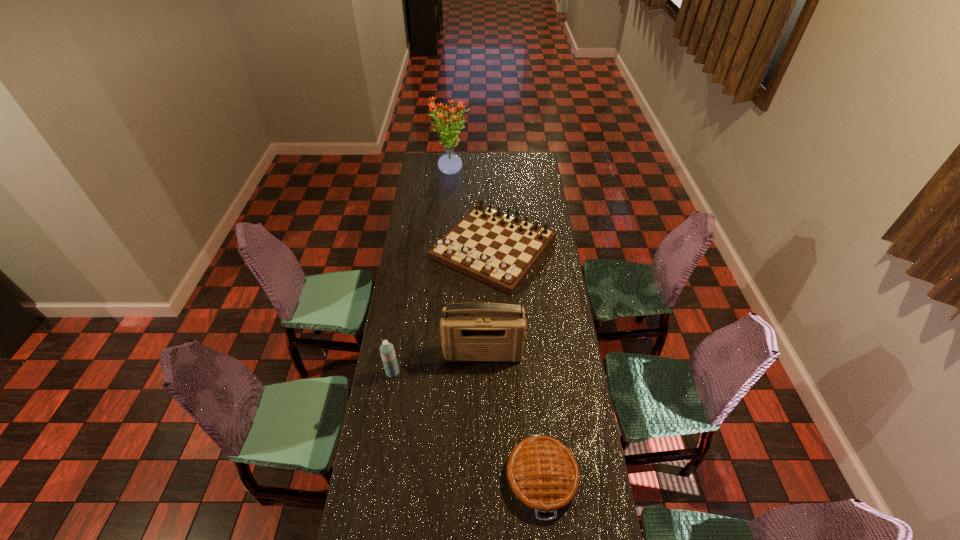
What are the coordinates of `object that is at the far left corner` in the screenshot? It's located at tap(449, 163).

Identify the location of vacant space at the far edge of the desktop. (482, 159).

Image resolution: width=960 pixels, height=540 pixels. In the image, there is a desktop. Find the location of `vacant space at the left edge`. vacant space at the left edge is located at coordinates (372, 503).

Where is `vacant space at the right edge of the desktop`? This screenshot has width=960, height=540. vacant space at the right edge of the desktop is located at coordinates (573, 524).

In the image, there is a desktop. Identify the location of vacant space at the far left corner. (441, 156).

Find the location of a particular element. The image size is (960, 540). free space at the far right corner is located at coordinates (540, 156).

The height and width of the screenshot is (540, 960). What are the coordinates of `free area in between the pie and the fourth shortest object` in the screenshot? It's located at (513, 415).

Where is `empty space between the third farthest object and the fourth nearest object`? empty space between the third farthest object and the fourth nearest object is located at coordinates (489, 301).

Where is `free area in between the second tallest object and the nearest object`? This screenshot has width=960, height=540. free area in between the second tallest object and the nearest object is located at coordinates (513, 415).

This screenshot has height=540, width=960. In order to click on vacant point located between the fourth nearest object and the third farthest object in this screenshot , I will do `click(489, 301)`.